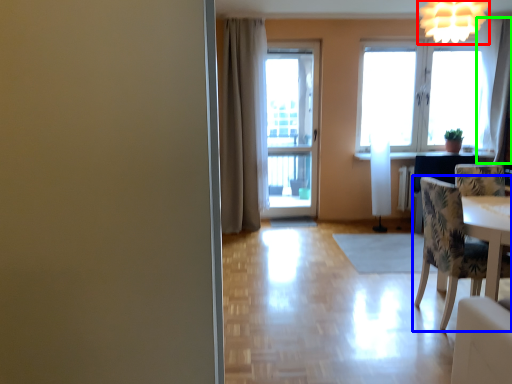
Question: Which is farther away from light fixture (highlighted by a red box)? chair (highlighted by a blue box) or curtain (highlighted by a green box)?

Choices:
 (A) chair
 (B) curtain

Answer: (B)